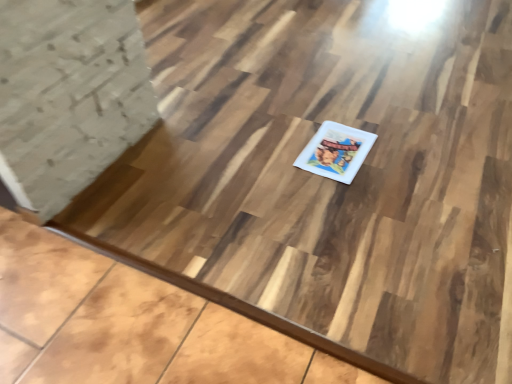
Where is `free space in front of white glossy book at center`? free space in front of white glossy book at center is located at coordinates (347, 197).